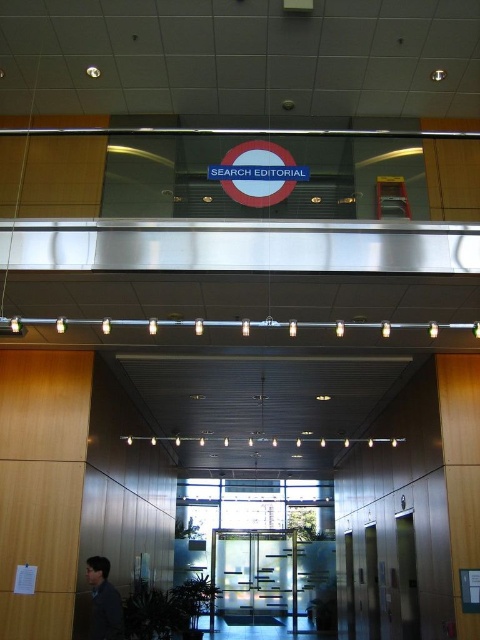
Question: Is transparent glass doors at center smaller than dark gray jacket at lower left?

Choices:
 (A) no
 (B) yes

Answer: (A)

Question: Which object is closer to the camera taking this photo?

Choices:
 (A) dark gray jacket at lower left
 (B) transparent glass doors at center

Answer: (A)

Question: Does transparent glass doors at center appear on the right side of dark gray jacket at lower left?

Choices:
 (A) no
 (B) yes

Answer: (B)

Question: Is transparent glass doors at center to the right of dark gray jacket at lower left from the viewer's perspective?

Choices:
 (A) yes
 (B) no

Answer: (A)

Question: Which object is farther from the camera taking this photo?

Choices:
 (A) dark gray jacket at lower left
 (B) transparent glass doors at center

Answer: (B)